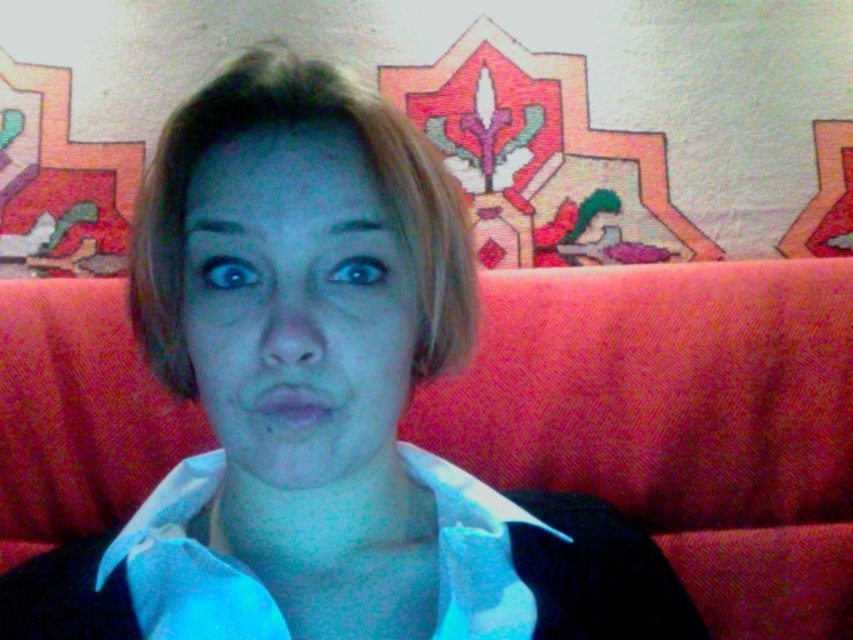
Does point (268, 216) come in front of point (289, 394)?

No, (268, 216) is further to viewer.

Which is above, matte skin face at center or matte pink lips at center?

Positioned higher is matte skin face at center.

Is point (281, 355) less distant than point (245, 406)?

Yes, point (281, 355) is closer to viewer.

At what (x,y) coordinates should I click in order to perform the action: click on matte skin face at center. Please return your answer as a coordinate pair (x, y). The image size is (853, 640). Looking at the image, I should click on (299, 308).

Can you confirm if white cotton shirt at center is wider than matte pink lips at center?

Yes.

Is white cotton shirt at center thinner than matte pink lips at center?

No, white cotton shirt at center is not thinner than matte pink lips at center.

Where is `white cotton shirt at center`? This screenshot has height=640, width=853. white cotton shirt at center is located at coordinates tap(187, 564).

Can you confirm if matte skin face at center is thinner than white cotton shirt at center?

Correct, matte skin face at center's width is less than white cotton shirt at center's.

You are a GUI agent. You are given a task and a screenshot of the screen. Output one action in this format:
    pyautogui.click(x=<x>, y=<y>)
    Task: Click on the matte skin face at center
    Image resolution: width=853 pixels, height=640 pixels.
    Given the screenshot: What is the action you would take?
    pyautogui.click(x=299, y=308)

This screenshot has width=853, height=640. In order to click on matte skin face at center in this screenshot , I will do `click(299, 308)`.